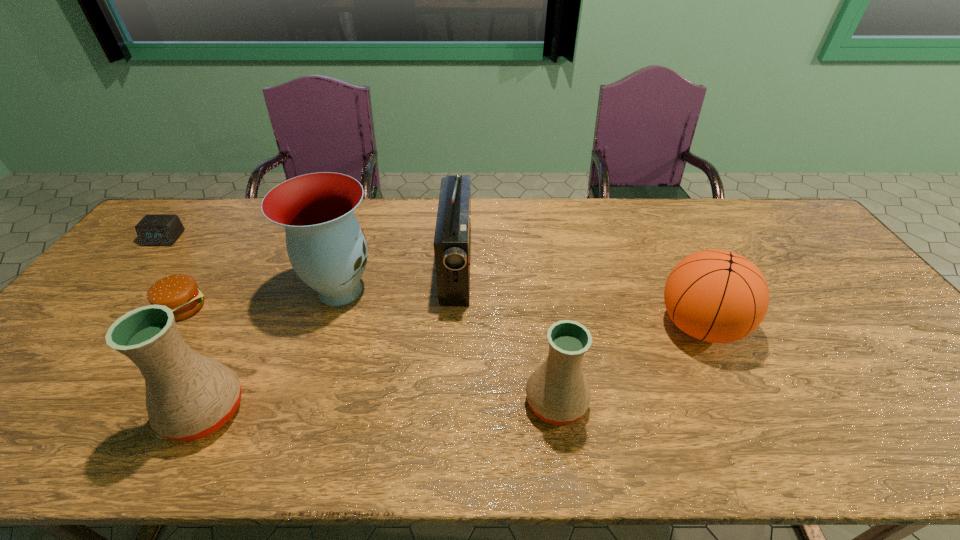
The image size is (960, 540). In order to click on the taller pottery in this screenshot , I will do `click(188, 396)`.

You are a GUI agent. You are given a task and a screenshot of the screen. Output one action in this format:
    pyautogui.click(x=<x>, y=<y>)
    Task: Click on the left pottery
    
    Given the screenshot: What is the action you would take?
    pyautogui.click(x=188, y=396)

Image resolution: width=960 pixels, height=540 pixels. Identify the location of the right pottery. (558, 392).

The width and height of the screenshot is (960, 540). What are the coordinates of `the sixth object from left to right` in the screenshot? It's located at (558, 392).

The height and width of the screenshot is (540, 960). In order to click on alarm clock in this screenshot , I will do `click(153, 230)`.

This screenshot has height=540, width=960. What are the coordinates of `the leftmost object` in the screenshot? It's located at (153, 230).

What are the coordinates of `the second object from left to right` in the screenshot? It's located at (179, 292).

Find the location of `hamburger`. hamburger is located at coordinates (179, 292).

Locate an element on the screen. radio receiver is located at coordinates (452, 242).

Locate an element on the screen. The height and width of the screenshot is (540, 960). basketball is located at coordinates (718, 296).